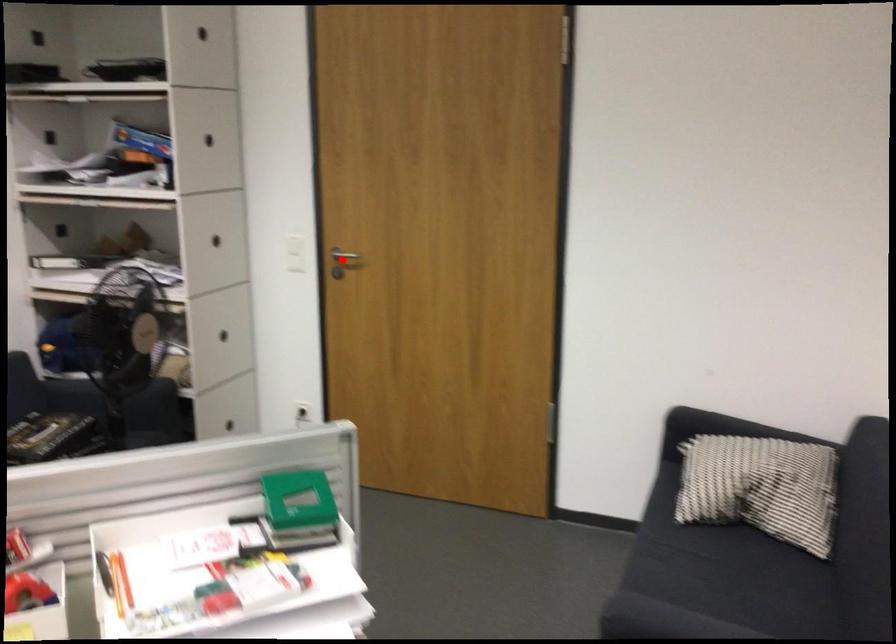
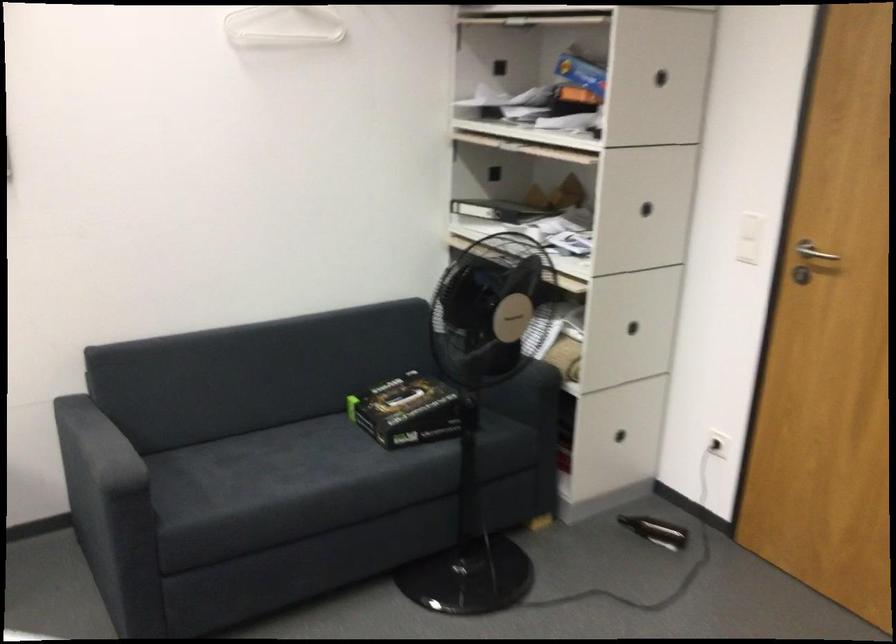
Question: A red point is marked in image1. In image2, is the corresponding 3D point closer to the camera or farther? Reply with the corresponding letter.

Choices:
 (A) The corresponding 3D point is closer.
 (B) The corresponding 3D point is farther.

Answer: (A)